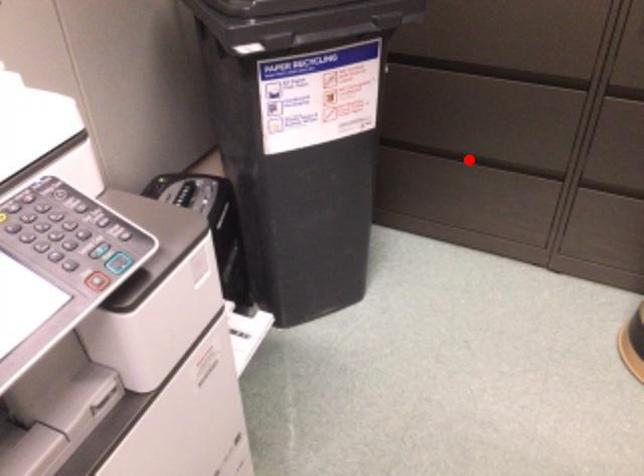
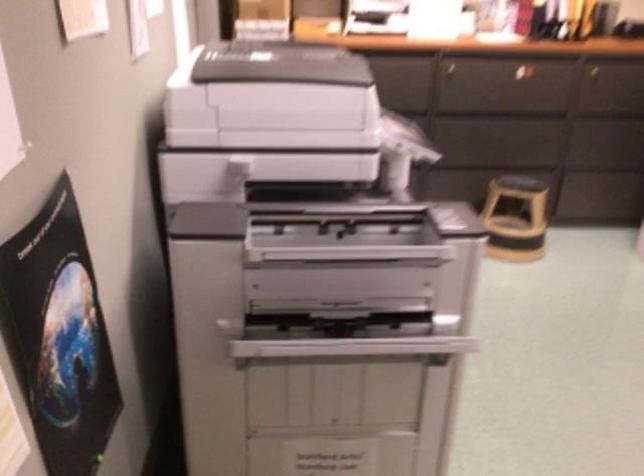
Question: I am providing you with two images of the same scene from different viewpoints. A red point is marked on the first image. At the location where the point appears in image 1, is it still visible in image 2?

Choices:
 (A) Yes
 (B) No

Answer: (B)